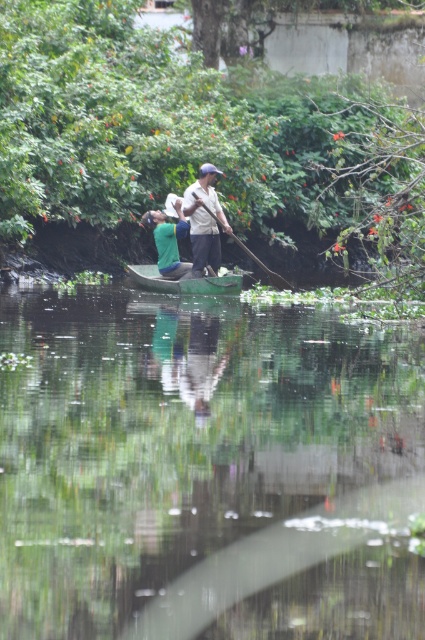
You are standing on the shore and see the boat with two people. There are two points marked on the boat. One is at coordinates point (192,264) and the other at point (266,269). Which point is closer to the front of the boat?

Point (192,264) is in front of point (266,269), so it is closer to the front of the boat.

You are standing at the camera position and want to place a 15 feet long ladder from the camera to the green plastic boat at center. Is the distance sufficient?

The distance between the camera and the green plastic boat at center is 21.44 feet, which is longer than the 15 feet ladder. Therefore, the ladder is not long enough to reach from the camera to the green plastic boat at center.

You are standing on the shore and want to board the green matte canoe at center. The wooden smooth paddle at center is in the boat. Which side of the canoe should you approach to find the paddle?

The wooden smooth paddle at center is to the right of the green matte canoe at center, so you should approach the right side of the canoe to find the paddle.